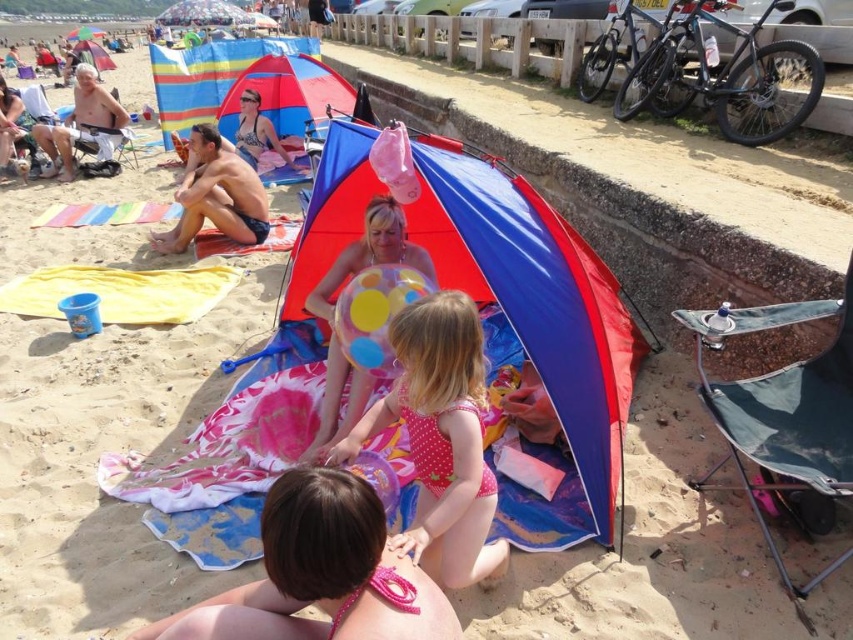
Between pink polka dot swimsuit at center and tan skin man at center, which one appears on the left side from the viewer's perspective?

tan skin man at center

Is point (422, 499) positioned after point (189, 164)?

No, (422, 499) is closer to viewer.

This screenshot has height=640, width=853. Find the location of `pink polka dot swimsuit at center`. pink polka dot swimsuit at center is located at coordinates click(x=440, y=438).

Is point (415, 308) behind point (108, 148)?

No, it is not.

Locate an element on the screen. The width and height of the screenshot is (853, 640). pink polka dot swimsuit at center is located at coordinates (440, 438).

Image resolution: width=853 pixels, height=640 pixels. I want to click on pink polka dot swimsuit at center, so click(440, 438).

Find the location of a particular element. pink polka dot swimsuit at center is located at coordinates (440, 438).

Is matte plastic umbrella at center to the left of shiny silver helmet at upper left from the viewer's perspective?

No, matte plastic umbrella at center is not to the left of shiny silver helmet at upper left.

Who is more forward, (294, 307) or (68, 168)?

Positioned in front is point (294, 307).

This screenshot has height=640, width=853. What are the coordinates of `matte plastic umbrella at center` in the screenshot? It's located at (537, 320).